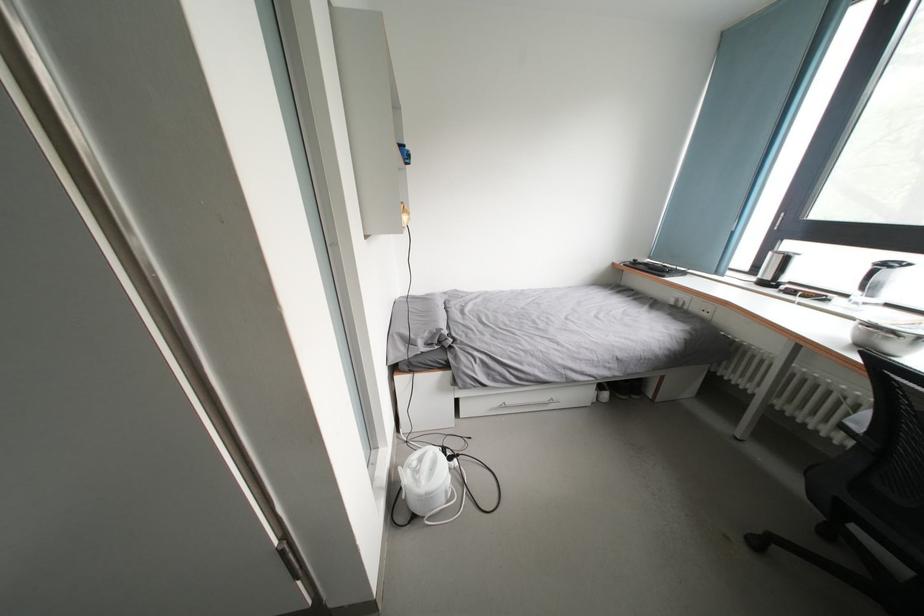
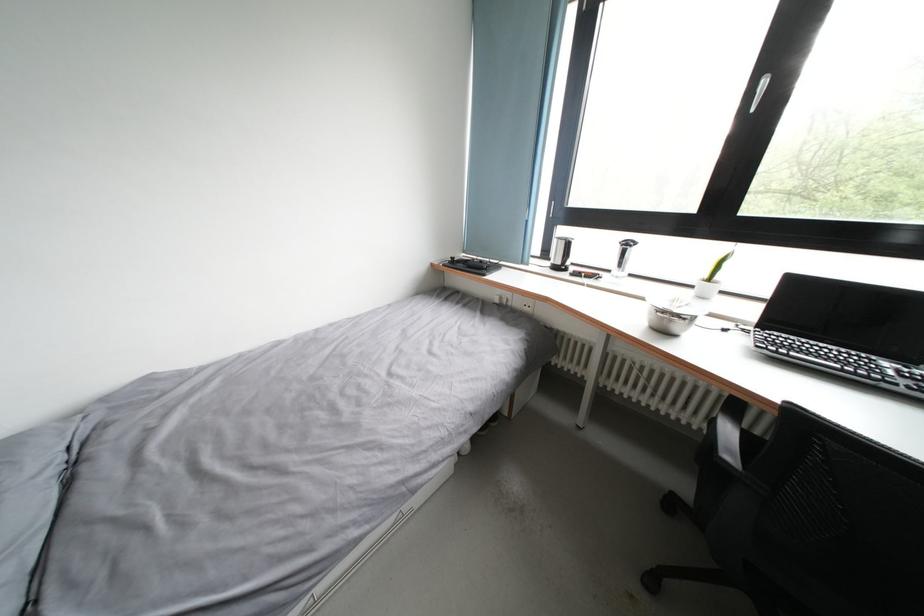
Find the pixel in the second image that matches [877,331] in the first image.

(670, 317)